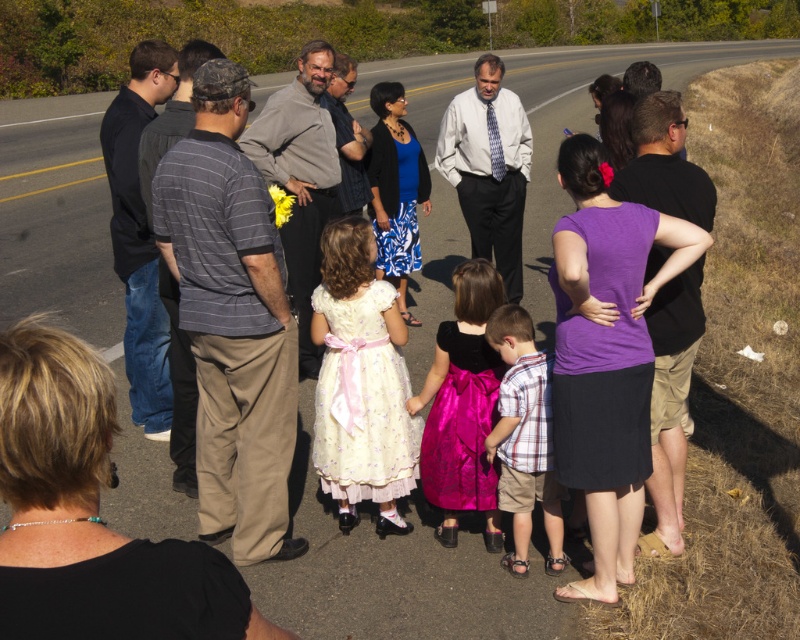
Measure the distance between plaid cotton shirt at center and gray striped shirt at center.

A distance of 11.46 feet exists between plaid cotton shirt at center and gray striped shirt at center.

Is plaid cotton shirt at center positioned in front of gray striped shirt at center?

Yes, it is.

Is point (518, 314) farther from viewer compared to point (370, 138)?

No, (518, 314) is closer to viewer.

Find the location of `plaid cotton shirt at center`. plaid cotton shirt at center is located at coordinates (524, 436).

Between black cotton shirt at left and gray sweater at center, which one is positioned higher?

gray sweater at center is above.

Describe the element at coordinates (140, 234) in the screenshot. This screenshot has height=640, width=800. I see `black cotton shirt at left` at that location.

Where is `black cotton shirt at left`? This screenshot has height=640, width=800. black cotton shirt at left is located at coordinates (140, 234).

Locate an element on the screen. black cotton shirt at left is located at coordinates (140, 234).

Does point (392, 424) lie in front of point (344, 132)?

Yes, point (392, 424) is closer to viewer.

Can you confirm if white lace dress at center is wider than gray striped shirt at center?

Indeed, white lace dress at center has a greater width compared to gray striped shirt at center.

Measure the distance between white lace dress at center and camera.

white lace dress at center is 4.25 meters away from camera.

At what (x,y) coordinates should I click in order to perform the action: click on white lace dress at center. Please return your answer as a coordinate pair (x, y). This screenshot has height=640, width=800. Looking at the image, I should click on (360, 380).